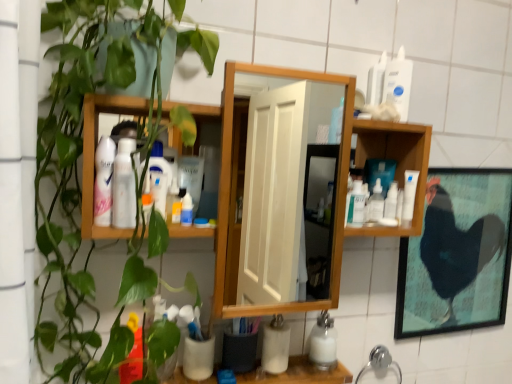
The width and height of the screenshot is (512, 384). I want to click on chrome metallic faucet at lower center, so click(379, 361).

Describe the element at coordinates (298, 374) in the screenshot. I see `white matte cup at lower center` at that location.

Describe the element at coordinates (103, 181) in the screenshot. I see `matte white spray can at upper left, positioned as the 4th toiletry in right-to-left order` at that location.

In order to click on matte white spray can at upper left, which ranks as the second toiletry in top-to-bottom order in this screenshot , I will do `click(103, 181)`.

In order to face clear plastic bottle at center-right, which is the 2th cleaning product in back-to-front order, should I rotate leftwards or rightwards?

Turn right by 16.236 degrees to look at clear plastic bottle at center-right, which is the 2th cleaning product in back-to-front order.

What do you see at coordinates (375, 204) in the screenshot? This screenshot has width=512, height=384. I see `clear plastic bottle at center-right, which is the 2th cleaning product in back-to-front order` at bounding box center [375, 204].

What are the coordinates of `chrome metallic faucet at lower center` in the screenshot? It's located at (379, 361).

Considering the positions of objects white matte cup at lower center, which is the 4th toiletry in top-to-bottom order, and white glossy bottle at upper right, arranged as the 4th cleaning product when viewed from the left, in the image provided, who is behind, white matte cup at lower center, which is the 4th toiletry in top-to-bottom order, or white glossy bottle at upper right, arranged as the 4th cleaning product when viewed from the left,?

white matte cup at lower center, which is the 4th toiletry in top-to-bottom order.

In the scene shown: From the image's perspective, which one is positioned higher, white matte cup at lower center, acting as the first toiletry starting from the bottom, or white glossy bottle at upper right, the second cleaning product in the front-to-back sequence?

white glossy bottle at upper right, the second cleaning product in the front-to-back sequence.

Between point (279, 314) and point (413, 178), which one is positioned behind?

The point (279, 314) is behind.

Considering the sizes of objects white matte cup at lower center, which is the 4th toiletry in top-to-bottom order, and white glossy bottle at upper right, the 3th cleaning product when ordered from back to front, in the image provided, who is taller, white matte cup at lower center, which is the 4th toiletry in top-to-bottom order, or white glossy bottle at upper right, the 3th cleaning product when ordered from back to front,?

white matte cup at lower center, which is the 4th toiletry in top-to-bottom order, is taller.

This screenshot has height=384, width=512. I want to click on the 1st toiletry counting from the right of the matte white spray can at upper left, which is counted as the third toiletry, starting from the back, so click(124, 186).

Who is smaller, white glossy lotion at upper left, the 3th toiletry in the right-to-left sequence, or matte white spray can at upper left, positioned as the 1th toiletry in left-to-right order?

Smaller between the two is white glossy lotion at upper left, the 3th toiletry in the right-to-left sequence.

In terms of height, does white glossy lotion at upper left, the 3th toiletry in the right-to-left sequence, look taller or shorter compared to matte white spray can at upper left, positioned as the second toiletry in front-to-back order?

Considering their sizes, white glossy lotion at upper left, the 3th toiletry in the right-to-left sequence, has less height than matte white spray can at upper left, positioned as the second toiletry in front-to-back order.

Are white glossy lotion at upper left, which is the third toiletry in top-to-bottom order, and matte white spray can at upper left, positioned as the second toiletry in front-to-back order, far apart?

white glossy lotion at upper left, which is the third toiletry in top-to-bottom order, is near matte white spray can at upper left, positioned as the second toiletry in front-to-back order, not far away.

From a real-world perspective, is translucent plastic spray bottle at center, the 4th cleaning product from the right, on black matte chicken at right?

Yes, from a real-world perspective, translucent plastic spray bottle at center, the 4th cleaning product from the right, is on top of black matte chicken at right.

Does translucent plastic spray bottle at center, the first cleaning product when ordered from top to bottom, turn towards black matte chicken at right?

No, translucent plastic spray bottle at center, the first cleaning product when ordered from top to bottom, is not facing towards black matte chicken at right.

Between translucent plastic spray bottle at center, the fourth cleaning product when ordered from back to front, and black matte chicken at right, which one has larger size?

black matte chicken at right.

Can we say translucent plastic spray bottle at center, marked as the first cleaning product in a front-to-back arrangement, lies outside black matte chicken at right?

Yes, translucent plastic spray bottle at center, marked as the first cleaning product in a front-to-back arrangement, is located beyond the bounds of black matte chicken at right.

From the picture: Is matte white spray can at upper left, the third toiletry in the bottom-to-top sequence, smaller than clear plastic bottle at center-right, arranged as the third cleaning product when viewed from the top?

Incorrect, matte white spray can at upper left, the third toiletry in the bottom-to-top sequence, is not smaller in size than clear plastic bottle at center-right, arranged as the third cleaning product when viewed from the top.

Can you tell me how much matte white spray can at upper left, which is counted as the third toiletry, starting from the back, and clear plastic bottle at center-right, arranged as the third cleaning product when viewed from the top, differ in facing direction?

3.25 degrees.

Can you confirm if matte white spray can at upper left, which is counted as the third toiletry, starting from the back, is wider than clear plastic bottle at center-right, placed as the 2th cleaning product when sorted from right to left?

Yes.

Does matte white spray can at upper left, positioned as the 4th toiletry in right-to-left order, turn towards clear plastic bottle at center-right, the 3th cleaning product in the left-to-right sequence?

No, matte white spray can at upper left, positioned as the 4th toiletry in right-to-left order, is not facing towards clear plastic bottle at center-right, the 3th cleaning product in the left-to-right sequence.

From a real-world perspective, between white matte cup at lower center, the second toiletry positioned from the back, and white matte cup at lower center, who is vertically lower?

white matte cup at lower center.

From the image's perspective, is white matte cup at lower center, arranged as the 3th toiletry when viewed from the left, under white matte cup at lower center?

No.

Does white matte cup at lower center, the second toiletry positioned from the back, turn towards white matte cup at lower center?

No, white matte cup at lower center, the second toiletry positioned from the back, is not oriented towards white matte cup at lower center.

What's the angular difference between white matte cup at lower center, arranged as the 3th toiletry when viewed from the left, and white matte cup at lower center's facing directions?

0.959 degrees.

Between white plastic bottle at upper right, arranged as the 1th toiletry when viewed from the back, and green matte plant at left, which one has more height?

green matte plant at left is taller.

From a real-world perspective, which is physically above, white plastic bottle at upper right, which ranks as the 1th toiletry in top-to-bottom order, or green matte plant at left?

white plastic bottle at upper right, which ranks as the 1th toiletry in top-to-bottom order.

Would you say white plastic bottle at upper right, arranged as the 4th toiletry when viewed from the front, is to the left or to the right of green matte plant at left in the picture?

In the image, white plastic bottle at upper right, arranged as the 4th toiletry when viewed from the front, appears on the right side of green matte plant at left.

From the picture: Between black matte chicken at right and white matte cup at lower center, marked as the 3th toiletry in a front-to-back arrangement, which one has smaller width?

With smaller width is black matte chicken at right.

Could you tell me if black matte chicken at right is turned towards white matte cup at lower center, marked as the 3th toiletry in a front-to-back arrangement?

No, black matte chicken at right is not turned towards white matte cup at lower center, marked as the 3th toiletry in a front-to-back arrangement.

From a real-world perspective, is black matte chicken at right physically below white matte cup at lower center, marked as the 3th toiletry in a front-to-back arrangement?

Actually, black matte chicken at right is physically above white matte cup at lower center, marked as the 3th toiletry in a front-to-back arrangement, in the real world.

Is black matte chicken at right not close to white matte cup at lower center, which is the 4th toiletry in top-to-bottom order?

black matte chicken at right is actually quite close to white matte cup at lower center, which is the 4th toiletry in top-to-bottom order.

The width and height of the screenshot is (512, 384). Identify the location of the 1st toiletry behind the white glossy bottle at upper right, the second cleaning product in the front-to-back sequence, starting your count from the anchor. (276, 345).

Locate an element on the screen. This screenshot has height=384, width=512. toiletry lying in front of the matte white spray can at upper left, which is counted as the third toiletry, starting from the back is located at coordinates (124, 186).

When comparing their distances from chrome metallic faucet at lower center, does white matte cup at lower center or green matte plant at left seem further?

Based on the image, green matte plant at left appears to be further to chrome metallic faucet at lower center.

When comparing their distances from white matte cup at lower center, the second toiletry positioned from the right, does matte white spray can at upper left, positioned as the 1th toiletry in left-to-right order, or white plastic bottle at upper right, which ranks as the 1th toiletry in top-to-bottom order, seem closer?

Among the two, matte white spray can at upper left, positioned as the 1th toiletry in left-to-right order, is located nearer to white matte cup at lower center, the second toiletry positioned from the right.

Looking at this image, which object lies further to the anchor point black matte chicken at right, clear plastic bottle at center-right, the 3th cleaning product in the front-to-back sequence, or chrome metallic faucet at lower center?

The object further to black matte chicken at right is clear plastic bottle at center-right, the 3th cleaning product in the front-to-back sequence.

Estimate the real-world distances between objects in this image. Which object is further from black matte chicken at right, translucent plastic spray bottle at center, the 1th cleaning product viewed from the left, or clear plastic bottle at center-right, which is the 2th cleaning product in back-to-front order?

translucent plastic spray bottle at center, the 1th cleaning product viewed from the left, lies further to black matte chicken at right than the other object.

Based on their spatial positions, is white matte cup at lower center, which is the 4th toiletry in top-to-bottom order, or white plastic bottle at upper right, the 1th toiletry from the right, closer to clear plastic bottle at center-right, the 3th cleaning product in the front-to-back sequence?

The object closer to clear plastic bottle at center-right, the 3th cleaning product in the front-to-back sequence, is white plastic bottle at upper right, the 1th toiletry from the right.

When comparing their distances from chrome metallic faucet at lower center, does green matte plant at left or matte white spray can at upper left, positioned as the 4th toiletry in right-to-left order, seem further?

Among the two, green matte plant at left is located further to chrome metallic faucet at lower center.

Which object lies nearer to the anchor point green matte plant at left, white matte bottle at lower center, positioned as the 1th cleaning product in bottom-to-top order, or clear plastic bottle at center-right, the 3th cleaning product in the front-to-back sequence?

Among the two, clear plastic bottle at center-right, the 3th cleaning product in the front-to-back sequence, is located nearer to green matte plant at left.

When comparing their distances from white plastic bottle at upper right, arranged as the 4th toiletry when viewed from the front, does white matte cup at lower center, the second toiletry positioned from the right, or chrome metallic faucet at lower center seem further?

chrome metallic faucet at lower center is further to white plastic bottle at upper right, arranged as the 4th toiletry when viewed from the front.

Identify the location of houseplant between white plastic bottle at upper right, which ranks as the 1th toiletry in top-to-bottom order, and white matte cup at lower center from top to bottom. The image size is (512, 384). (82, 152).

Where is `faucet between matte white spray can at upper left, positioned as the second toiletry in front-to-back order, and black matte chicken at right, in the horizontal direction`? This screenshot has width=512, height=384. faucet between matte white spray can at upper left, positioned as the second toiletry in front-to-back order, and black matte chicken at right, in the horizontal direction is located at coordinates (379, 361).

Image resolution: width=512 pixels, height=384 pixels. What are the coordinates of `counter top located between matte white spray can at upper left, positioned as the second toiletry in front-to-back order, and white glossy bottle at upper right, the first cleaning product from the right, in the left-right direction` in the screenshot? It's located at (298, 374).

This screenshot has width=512, height=384. I want to click on cleaning product between white glossy bottle at upper right, the 2th cleaning product positioned from the top, and white matte bottle at lower center, the 3th cleaning product in the right-to-left sequence, from top to bottom, so [x=375, y=204].